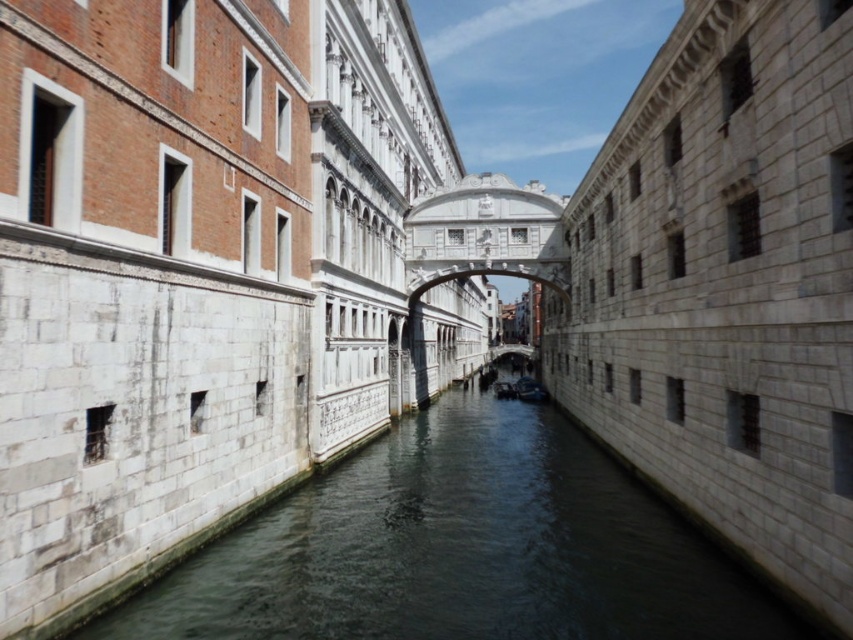
You are a tourist standing on the Bridge of Sighs and want to take a photo of the dark gray stone water at center and the dark blue fabric boat at center. Which object should you focus on first if you want to capture both in one shot without moving the camera?

You should focus on the dark gray stone water at center first because it is to the left of the dark blue fabric boat at center, so positioning the camera to include both would require framing from the left side towards the center.

You are a tourist standing on the Bridge of Sighs and want to take a photo of the dark gray stone water at center and the dark blue fabric boat at center. Which object should you focus on first to ensure both are in the frame?

You should focus on the dark gray stone water at center first because it might be wider than the dark blue fabric boat at center, so centering it ensures both fit within the frame.

You are standing at the point marked by coordinates point (461, 548) in the canal scene. Based on the scene description, what is the material of the surface you are currently standing on?

The surface at point (461, 548) is dark gray stone water at center, so the material is dark gray stone.